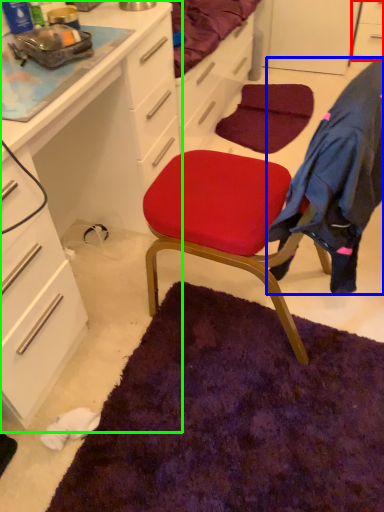
Question: Based on their relative distances, which object is farther from cabinetry (highlighted by a red box)? Choose from clothing (highlighted by a blue box) and cabinetry (highlighted by a green box).

Choices:
 (A) clothing
 (B) cabinetry

Answer: (A)